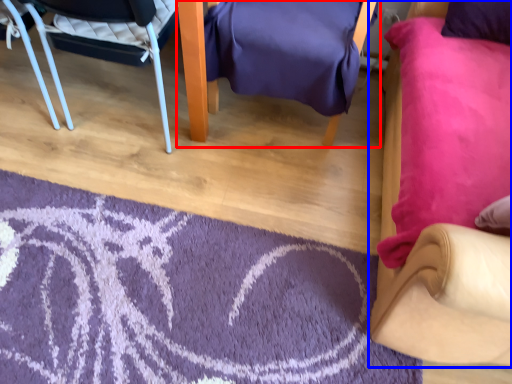
Question: Which of the following is the farthest to the observer, chair (highlighted by a red box) or chair (highlighted by a blue box)?

Choices:
 (A) chair
 (B) chair

Answer: (A)